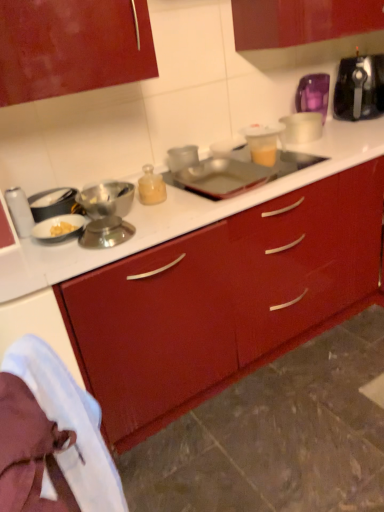
Question: Is metallic canister at left, which ranks as the first appliance in left-to-right order, to the left or to the right of metallic silver tray at center, which is the 3th appliance from right to left, in the image?

Choices:
 (A) right
 (B) left

Answer: (B)

Question: Is metallic canister at left, which ranks as the first appliance in left-to-right order, wider or thinner than metallic silver tray at center, which is the 3th appliance from right to left?

Choices:
 (A) wide
 (B) thin

Answer: (B)

Question: Which is nearer to the white fabric at lower left?

Choices:
 (A) metallic canister at left, arranged as the 4th appliance when viewed from the right
 (B) black plastic toaster at upper right
 (C) translucent plastic cup at upper center, marked as the 3th appliance in a left-to-right arrangement
 (D) metallic silver tray at center, which is the 3th appliance from right to left
 (E) translucent plastic cup at upper right, the first appliance in the right-to-left sequence

Answer: (A)

Question: Estimate the real-world distances between objects in this image. Which object is closer to the metallic silver tray at center, the second appliance from the left?

Choices:
 (A) metallic canister at left, which ranks as the first appliance in left-to-right order
 (B) black plastic toaster at upper right
 (C) translucent plastic cup at upper right, which is counted as the fourth appliance, starting from the left
 (D) white fabric at lower left
 (E) translucent plastic cup at upper center, marked as the 3th appliance in a left-to-right arrangement

Answer: (E)